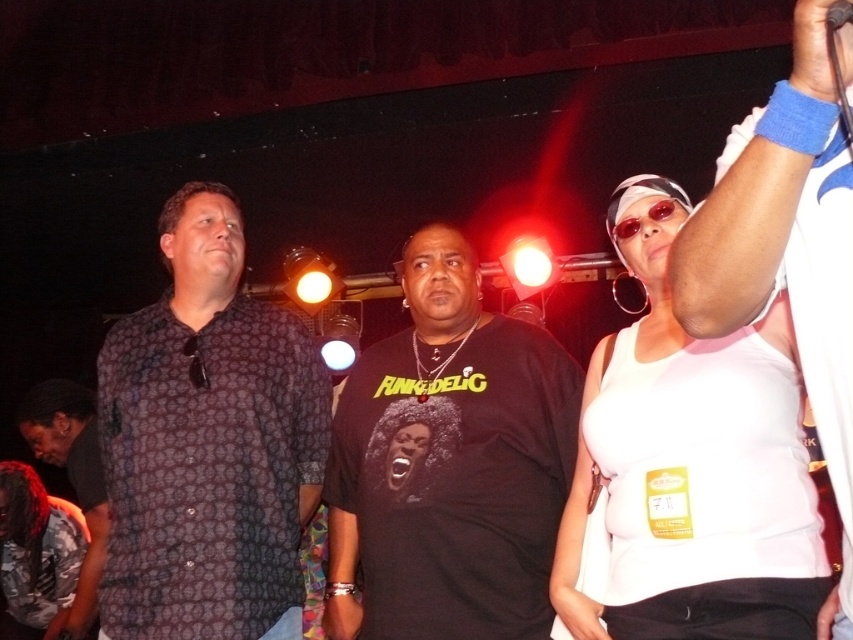
Question: Does patterned fabric shirt at left appear on the left side of white tank top at right?

Choices:
 (A) yes
 (B) no

Answer: (A)

Question: Is white matte tank top at upper right above white tank top at right?

Choices:
 (A) no
 (B) yes

Answer: (A)

Question: Which point is closer to the camera?

Choices:
 (A) (132, 381)
 (B) (88, 620)
 (C) (697, 298)

Answer: (C)

Question: Which object appears farthest from the camera in this image?

Choices:
 (A) white matte tank top at upper right
 (B) black matte shirt at center
 (C) white tank top at right
 (D) patterned fabric shirt at left

Answer: (D)

Question: Is the position of black matte shirt at center less distant than that of white matte tank top at upper right?

Choices:
 (A) no
 (B) yes

Answer: (A)

Question: Which of the following is the farthest from the observer?

Choices:
 (A) white matte tank top at upper right
 (B) black matte shirt at center
 (C) white tank top at right

Answer: (B)